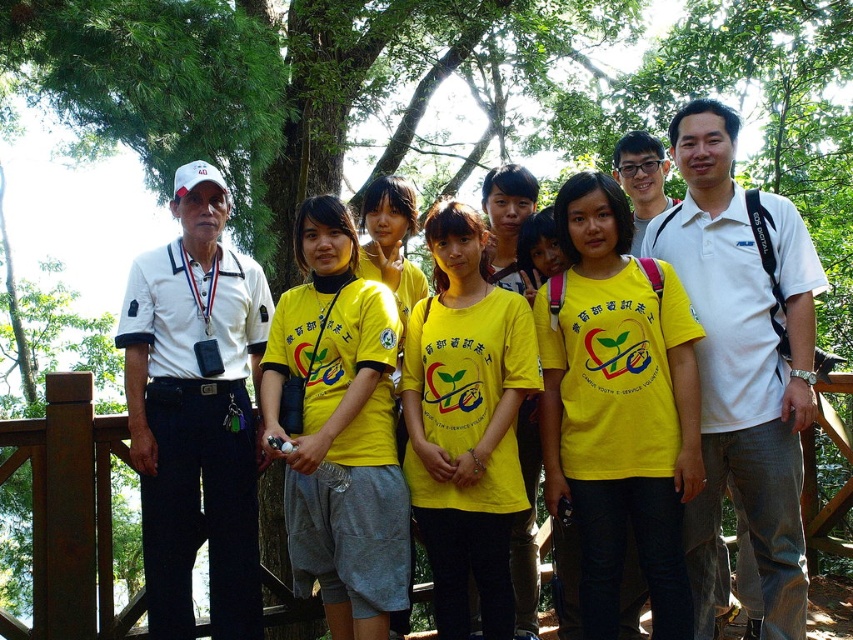
Question: Estimate the real-world distances between objects in this image. Which object is closer to the white matte shirt at left?

Choices:
 (A) yellow cotton shirt at center
 (B) yellow matte shirt at center
 (C) white cotton polo shirt at center
 (D) white matte shirt at center

Answer: (A)

Question: Which of the following is the closest to the observer?

Choices:
 (A) (292, 344)
 (B) (659, 403)
 (C) (221, 444)

Answer: (B)

Question: Which is nearer to the white matte shirt at left?

Choices:
 (A) white cotton polo shirt at center
 (B) white matte shirt at center

Answer: (A)

Question: Does white cotton polo shirt at center appear over white matte shirt at center?

Choices:
 (A) no
 (B) yes

Answer: (A)

Question: Can you confirm if yellow matte shirt at center is positioned below white matte shirt at left?

Choices:
 (A) yes
 (B) no

Answer: (B)

Question: Does white matte shirt at left have a larger size compared to white matte shirt at center?

Choices:
 (A) yes
 (B) no

Answer: (A)